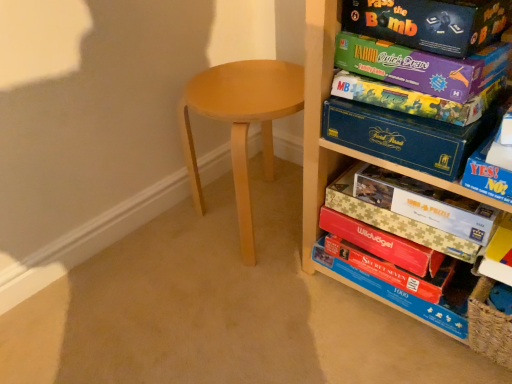
Question: From a real-world perspective, is blue cardboard box at right physically located above or below wooden shelf at right?

Choices:
 (A) above
 (B) below

Answer: (A)

Question: Is blue cardboard box at right inside or outside of wooden shelf at right?

Choices:
 (A) outside
 (B) inside

Answer: (B)

Question: Which object is positioned farthest from the matte black game box at upper right, arranged as the sixth paperback book when ordered from the bottom?

Choices:
 (A) blue cardboard box at right, which appears as the fourth paperback book when viewed from the top
 (B) light brown wood stool at center
 (C) red matte puzzle box at lower right, the 1th paperback book from the bottom
 (D) blue cardboard box at right
 (E) matte cardboard game box at upper right, which is counted as the 2th paperback book, starting from the top

Answer: (C)

Question: Which object is the farthest from the blue cardboard box at right, which ranks as the 3th paperback book in bottom-to-top order?

Choices:
 (A) beige cardboard puzzle at center-right, the 2th paperback book from the bottom
 (B) matte purple board game at upper right, the third paperback book in the top-to-bottom sequence
 (C) blue cardboard puzzle at lower right
 (D) wooden shelf at right
 (E) matte black game box at upper right, which is the first paperback book in top-to-bottom order

Answer: (C)